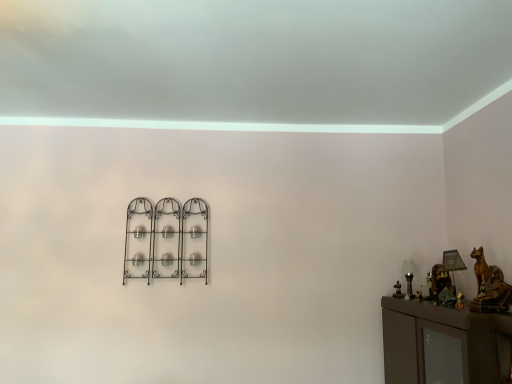
Question: Is metallic gold table lamp at right, the 1th table lamp positioned from the front, at the back of white glass table lamp at right, arranged as the second table lamp when viewed from the right?

Choices:
 (A) no
 (B) yes

Answer: (A)

Question: Is white glass table lamp at right, the 2th table lamp when ordered from front to back, positioned beyond the bounds of metallic gold table lamp at right, the 1th table lamp positioned from the front?

Choices:
 (A) yes
 (B) no

Answer: (A)

Question: From a real-world perspective, is white glass table lamp at right, the 2th table lamp when ordered from front to back, under metallic gold table lamp at right, placed as the second table lamp when sorted from back to front?

Choices:
 (A) no
 (B) yes

Answer: (B)

Question: Is metallic gold table lamp at right, which appears as the second table lamp when viewed from the left, inside white glass table lamp at right, which ranks as the 1th table lamp in back-to-front order?

Choices:
 (A) yes
 (B) no

Answer: (B)

Question: Considering the relative positions of white glass table lamp at right, the 2th table lamp when ordered from front to back, and metallic gold table lamp at right, placed as the second table lamp when sorted from back to front, in the image provided, is white glass table lamp at right, the 2th table lamp when ordered from front to back, in front of metallic gold table lamp at right, placed as the second table lamp when sorted from back to front,?

Choices:
 (A) yes
 (B) no

Answer: (B)

Question: Is white glass table lamp at right, which is counted as the first table lamp, starting from the left, smaller than metallic gold table lamp at right, placed as the second table lamp when sorted from back to front?

Choices:
 (A) yes
 (B) no

Answer: (A)

Question: Is black wrought iron candle holder at center thinner than white glass table lamp at right, arranged as the second table lamp when viewed from the right?

Choices:
 (A) no
 (B) yes

Answer: (B)

Question: Considering the relative positions of black wrought iron candle holder at center and white glass table lamp at right, arranged as the second table lamp when viewed from the right, in the image provided, is black wrought iron candle holder at center behind white glass table lamp at right, arranged as the second table lamp when viewed from the right,?

Choices:
 (A) no
 (B) yes

Answer: (B)

Question: From the image's perspective, is black wrought iron candle holder at center beneath white glass table lamp at right, which ranks as the 1th table lamp in back-to-front order?

Choices:
 (A) no
 (B) yes

Answer: (A)

Question: From a real-world perspective, is black wrought iron candle holder at center over white glass table lamp at right, the 2th table lamp when ordered from front to back?

Choices:
 (A) no
 (B) yes

Answer: (B)

Question: Considering the relative sizes of black wrought iron candle holder at center and white glass table lamp at right, which is counted as the first table lamp, starting from the left, in the image provided, is black wrought iron candle holder at center smaller than white glass table lamp at right, which is counted as the first table lamp, starting from the left,?

Choices:
 (A) yes
 (B) no

Answer: (B)

Question: Could you tell me if black wrought iron candle holder at center is turned towards white glass table lamp at right, the 2th table lamp when ordered from front to back?

Choices:
 (A) no
 (B) yes

Answer: (A)

Question: Is metallic gold table lamp at right, which appears as the second table lamp when viewed from the left, positioned before white glass table lamp at right, the 2th table lamp when ordered from front to back?

Choices:
 (A) yes
 (B) no

Answer: (A)